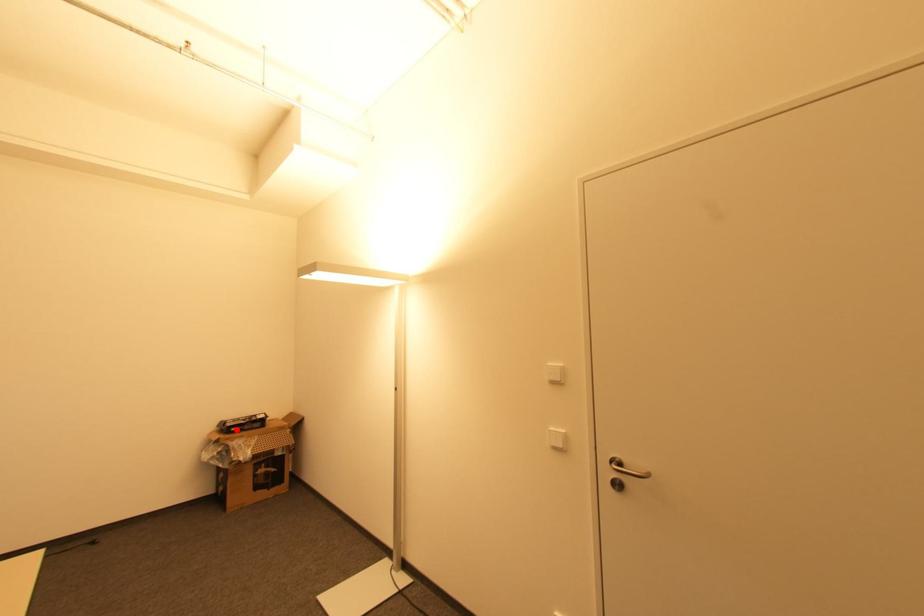
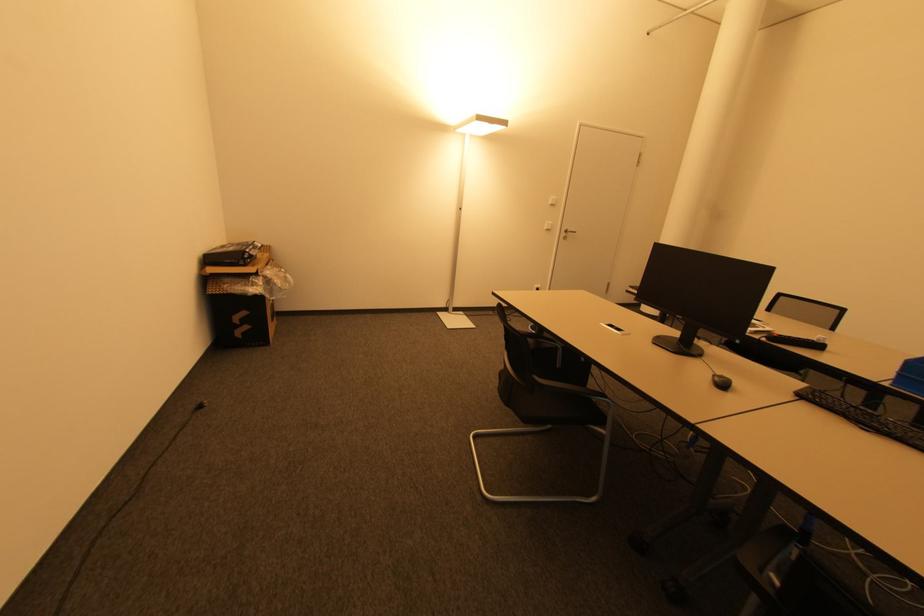
Question: I am providing you with two images of the same scene from different viewpoints. Given a red point in image1, look at the same physical point in image2. Is it:

Choices:
 (A) Closer to the viewpoint
 (B) Farther from the viewpoint

Answer: (A)